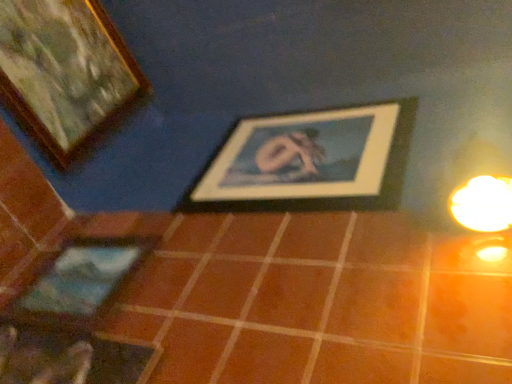
Find the location of a particular element. The width and height of the screenshot is (512, 384). free space above wooden picture frame at upper left, which is the first picture frame from top to bottom (from a real-world perspective) is located at coordinates (130, 43).